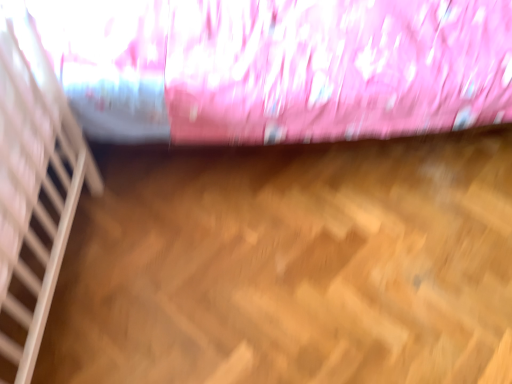
Question: Would you say pink satin curtain at upper center is inside or outside white wooden stairwell at left?

Choices:
 (A) outside
 (B) inside

Answer: (A)

Question: Is point (468, 84) positioned closer to the camera than point (58, 137)?

Choices:
 (A) closer
 (B) farther

Answer: (B)

Question: From a real-world perspective, relative to white wooden stairwell at left, is pink satin curtain at upper center vertically above or below?

Choices:
 (A) above
 (B) below

Answer: (B)

Question: Would you say white wooden stairwell at left is to the left or to the right of pink satin curtain at upper center in the picture?

Choices:
 (A) right
 (B) left

Answer: (B)

Question: In terms of height, does white wooden stairwell at left look taller or shorter compared to pink satin curtain at upper center?

Choices:
 (A) tall
 (B) short

Answer: (B)

Question: Do you think white wooden stairwell at left is within pink satin curtain at upper center, or outside of it?

Choices:
 (A) inside
 (B) outside

Answer: (B)

Question: Looking at their shapes, would you say white wooden stairwell at left is wider or thinner than pink satin curtain at upper center?

Choices:
 (A) wide
 (B) thin

Answer: (B)